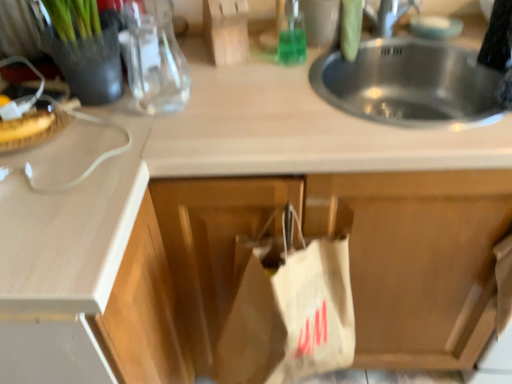
At what (x,y) coordinates should I click in order to perform the action: click on free space in front of green glass bottle at upper center, the 1th bottle viewed from the right. Please return your answer as a coordinate pair (x, y). This screenshot has height=384, width=512. Looking at the image, I should click on (286, 96).